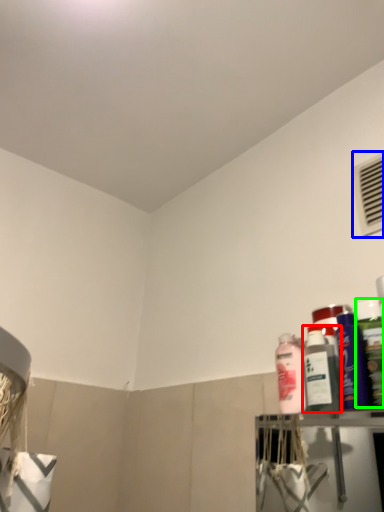
Question: Which object is the farthest from bottle (highlighted by a red box)? Choose among these: air conditioning (highlighted by a blue box) or cleaning product (highlighted by a green box).

Choices:
 (A) air conditioning
 (B) cleaning product

Answer: (A)